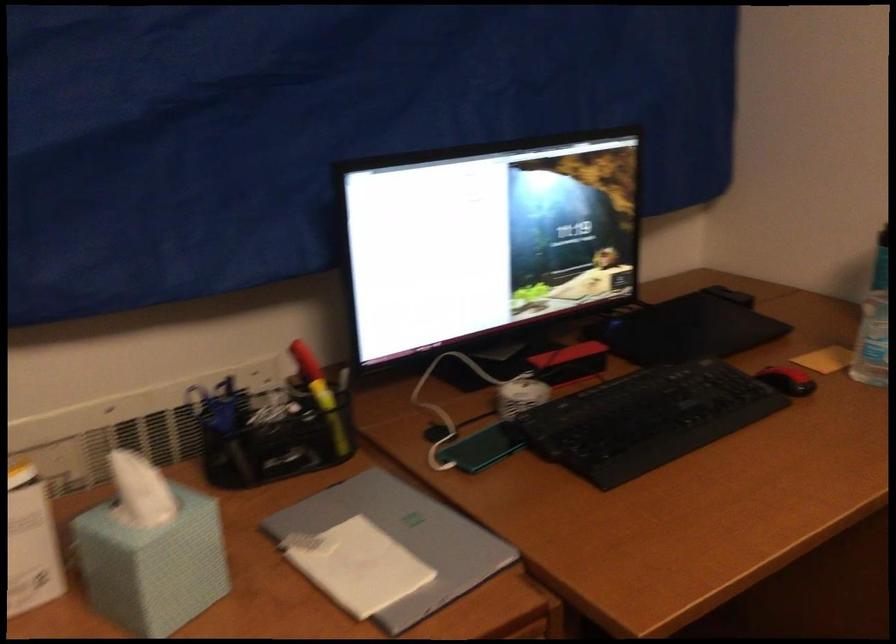
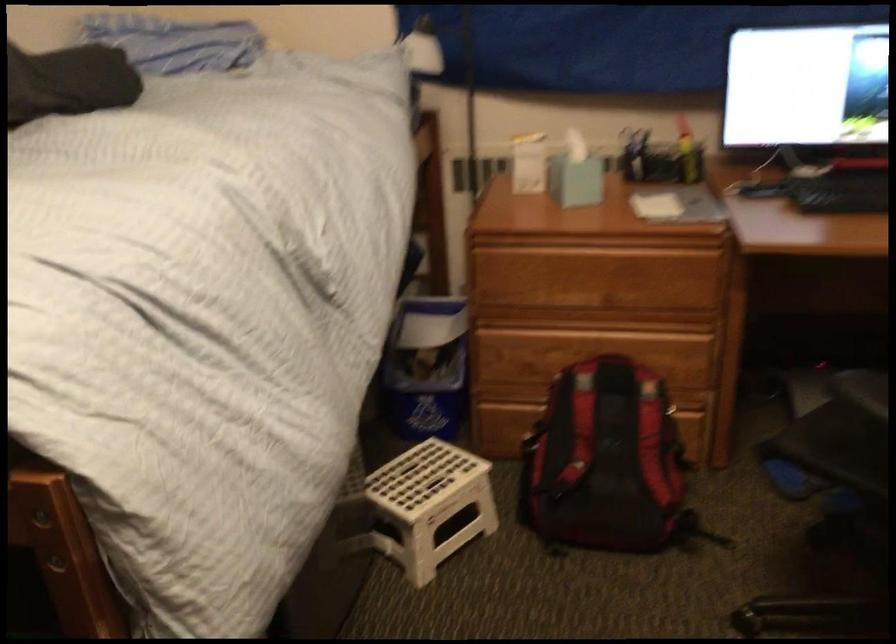
Locate, in the second image, the point that corresponds to pixel 282 430 in the first image.

(660, 158)